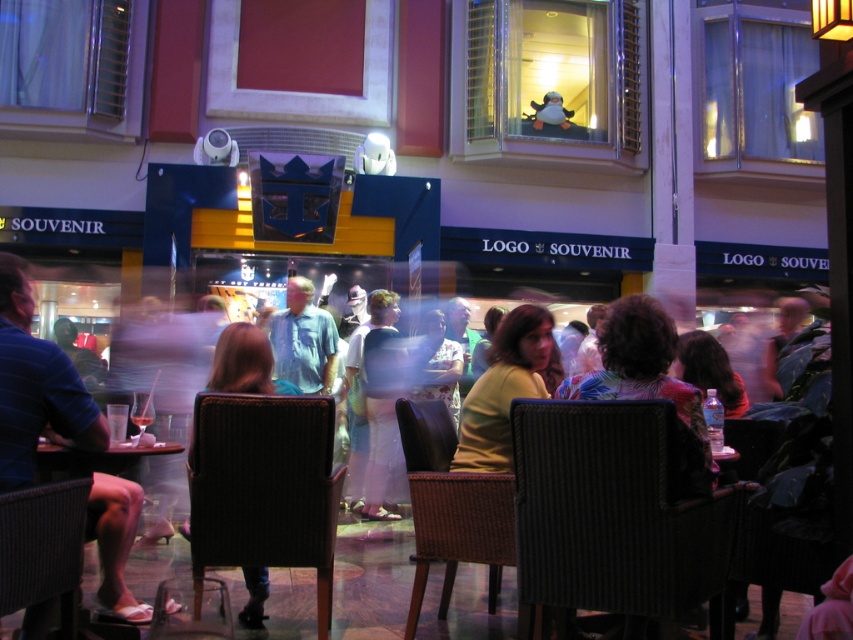
You are a photographer standing at the entrance of the shopping arcade. You notice a point at coordinates (300, 339) in the image. Which object in the scene is located at that point?

The point at coordinates (300, 339) is located on the blue cotton shirt at center.

You are a customer sitting in the dark brown leather chair at center. You want to grab the blue cotton shirt at center to check its fabric. Is the shirt within easy reach from your current position?

The blue cotton shirt at center is located above the dark brown leather chair at center, so it might be reachable by stretching upwards, but the exact distance isn

You are a customer in the mall and you want to place your yellow matte shirt at center on the wooden table at lower left. Can you fit it vertically on the table?

The yellow matte shirt at center is not as tall as the wooden table at lower left, so it can be placed vertically on the table without any issues.